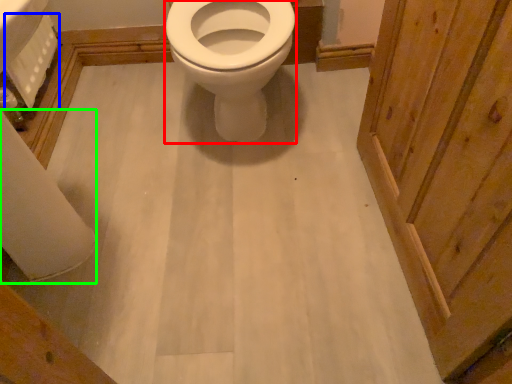
Question: Which object is the closest to the bidet (highlighted by a red box)? Choose among these: toilet paper (highlighted by a blue box) or toilet paper (highlighted by a green box).

Choices:
 (A) toilet paper
 (B) toilet paper

Answer: (A)